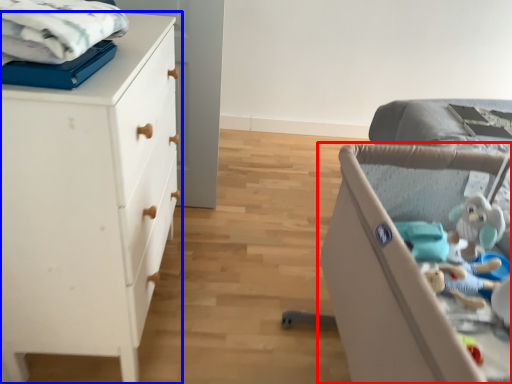
Question: Which of the following is the closest to the observer, infant bed (highlighted by a red box) or chest of drawers (highlighted by a blue box)?

Choices:
 (A) infant bed
 (B) chest of drawers

Answer: (A)